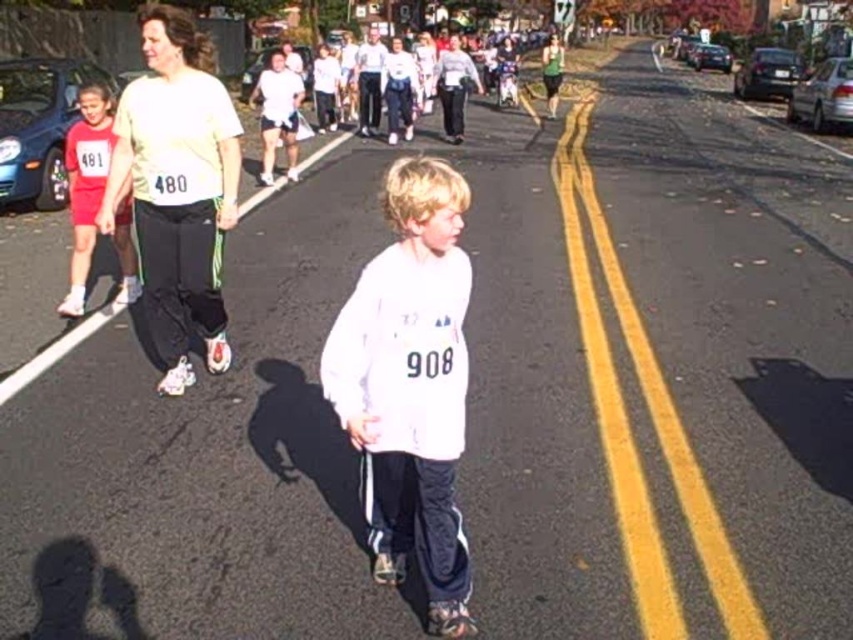
Question: Which of the following is the farthest from the observer?

Choices:
 (A) matte white shirt at left
 (B) white matte shirt at center

Answer: (A)

Question: Is matte white shirt at left below matte red shorts at left?

Choices:
 (A) yes
 (B) no

Answer: (A)

Question: Is matte white shirt at left wider than matte red shorts at left?

Choices:
 (A) yes
 (B) no

Answer: (A)

Question: Which of the following is the farthest from the observer?

Choices:
 (A) (91, 212)
 (B) (181, 72)

Answer: (A)

Question: Which object is the farthest from the matte white shirt at left?

Choices:
 (A) matte red shorts at left
 (B) white matte shirt at center

Answer: (B)

Question: Can you confirm if white matte shirt at center is smaller than matte red shorts at left?

Choices:
 (A) yes
 (B) no

Answer: (A)